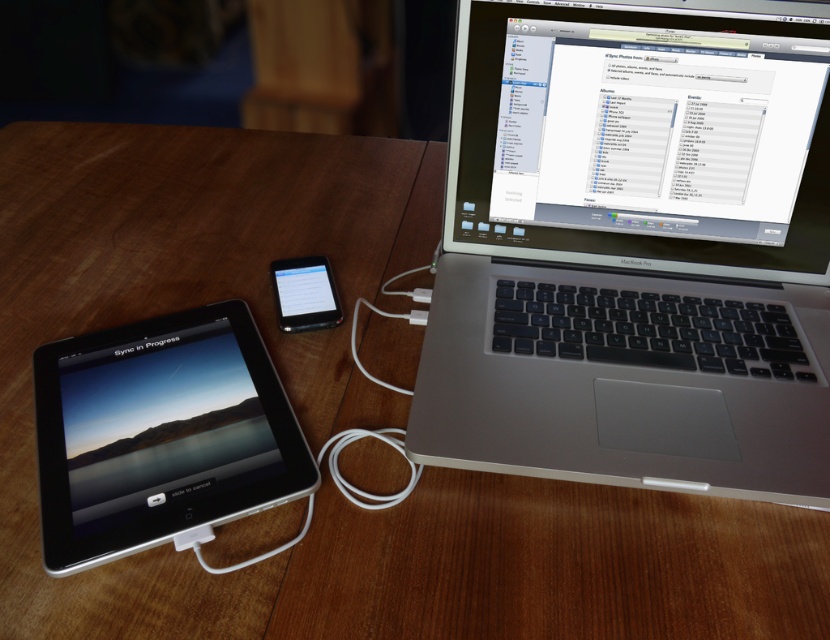
You are looking at the workspace setup. There are two points marked on the image. The first point is at coordinates point (755, 209) and the second point is at point (298, 289). Which point is closer to you?

Point (755, 209) is in front of point (298, 289), so the first point is closer to you.